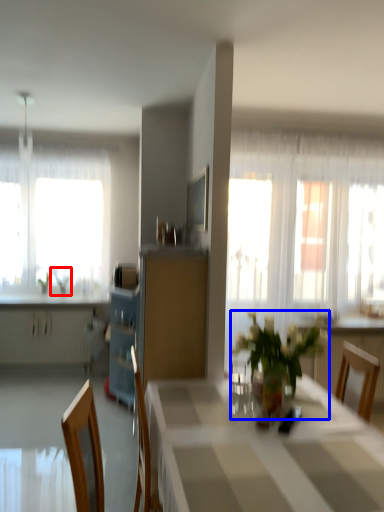
Question: Which point is further to the camera, plant (highlighted by a red box) or houseplant (highlighted by a blue box)?

Choices:
 (A) plant
 (B) houseplant

Answer: (A)